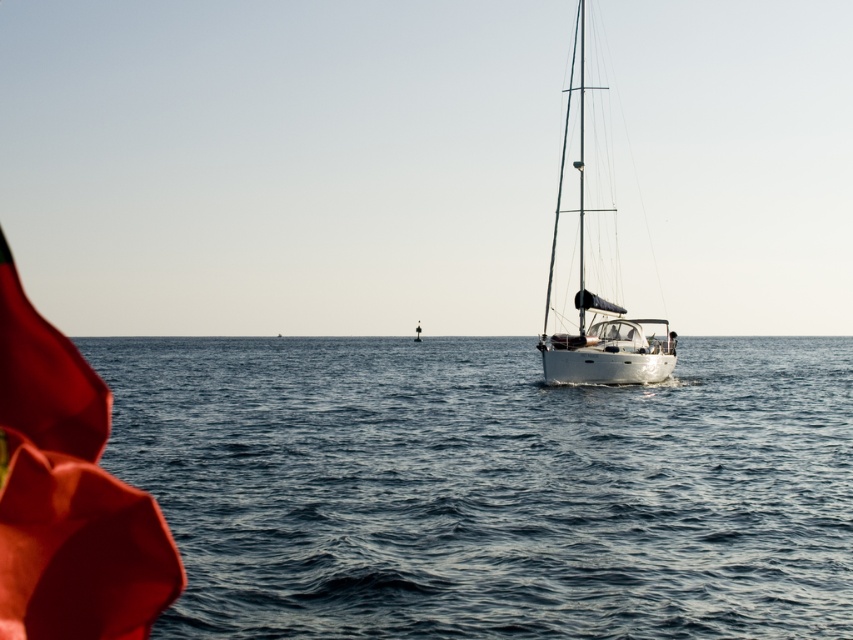
You are standing on a deck and want to throw a floating ring into the blue water at lower left. The ring has a diameter of 0.8 meters. Will it land in the water without hitting the deck edge? Please explain.

The blue water at lower left is 5.97 meters from the camera, so the floating ring with a diameter of 0.8 meters will easily land in the water without hitting the deck edge since the distance is sufficient.

Consider the image. You are standing on the deck of a ship and see the blue water at lower left and the white glossy sailboat at center. Which object is located to the left of the other?

The blue water at lower left is positioned on the left side of white glossy sailboat at center.

You are a photographer planning to capture the blue water at lower left and the white glossy sailboat at center in a single frame. Based on their widths, which object should you position closer to the center of the frame to ensure both fit without cropping?

The blue water at lower left is wider than the white glossy sailboat at center. To fit both in the frame without cropping, position the blue water at lower left closer to the center since it requires more space.